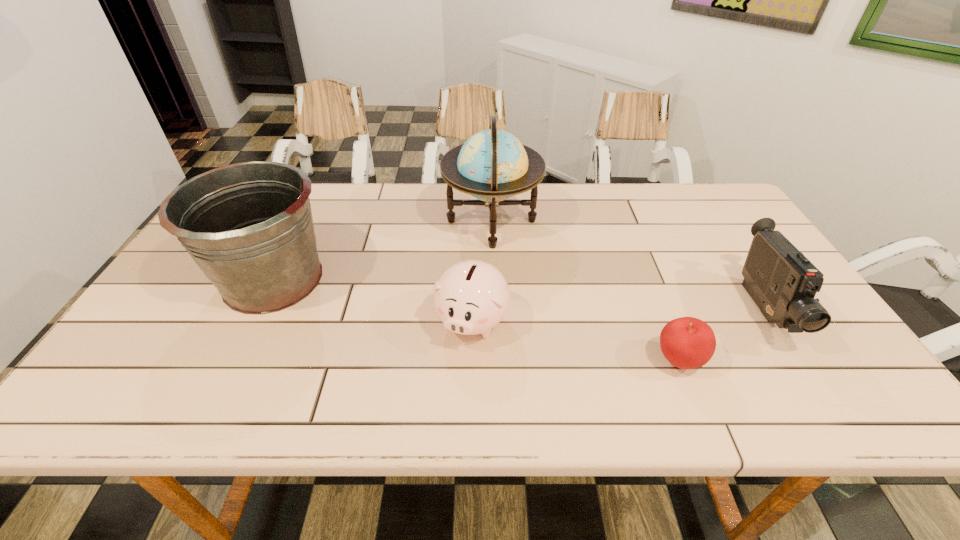
Locate which object is the closest to the apple. Please provide its 2D coordinates. Your answer should be formatted as a tuple, i.e. [(x, y)], where the tuple contains the x and y coordinates of a point satisfying the conditions above.

[(782, 282)]